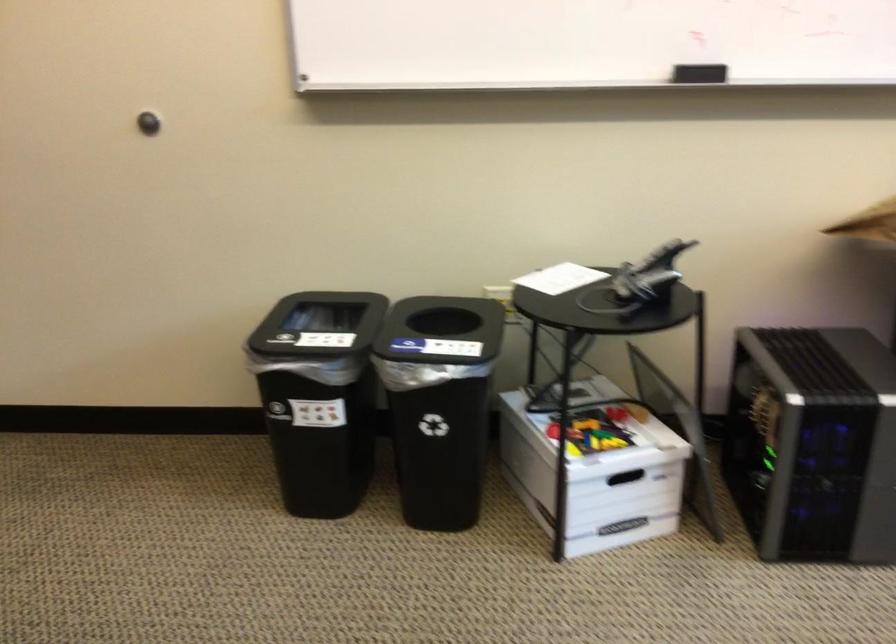
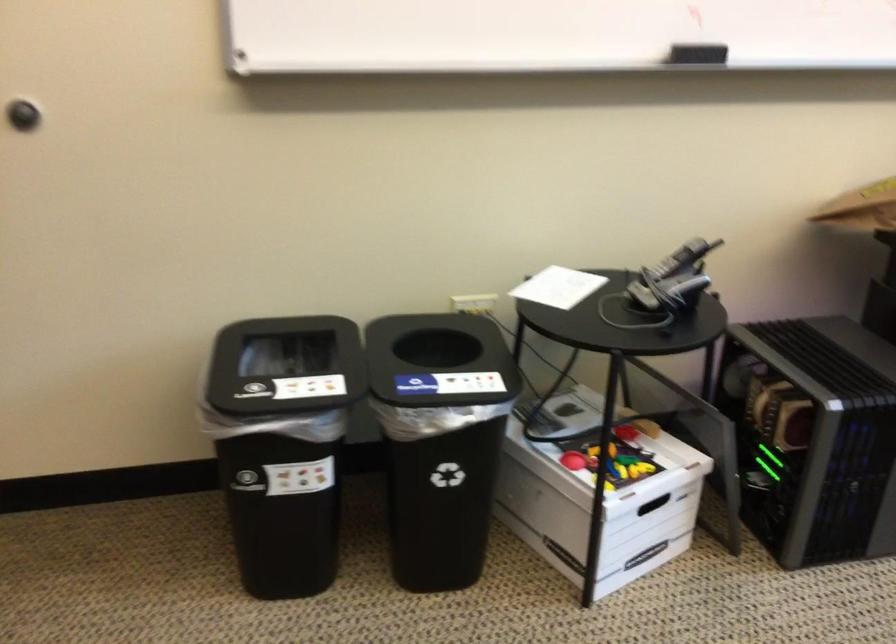
Locate, in the second image, the point that corresponds to (x=774, y=429) in the first image.

(813, 436)